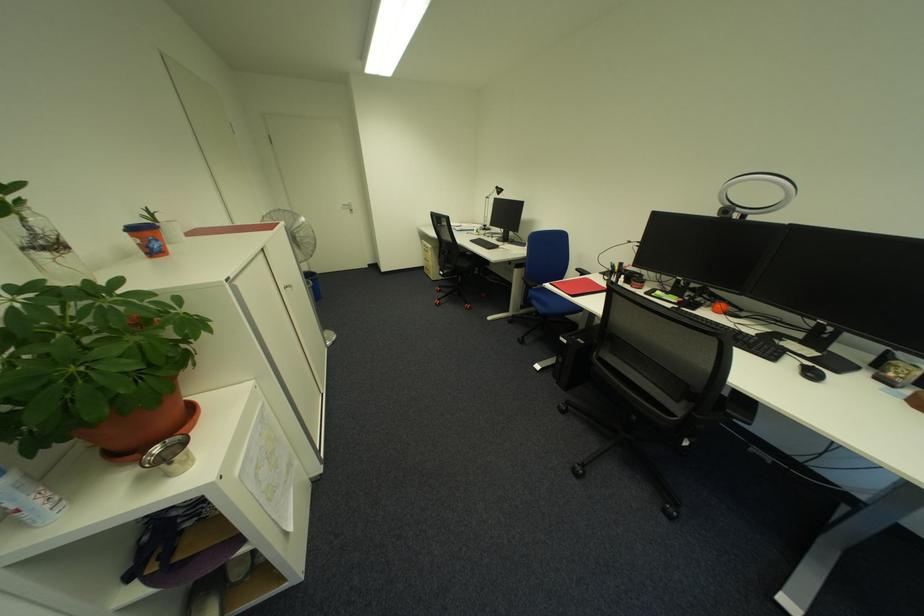
Find where to lift the white coffee mug. Please return your answer as a coordinate pair (x, y).

(172, 231)